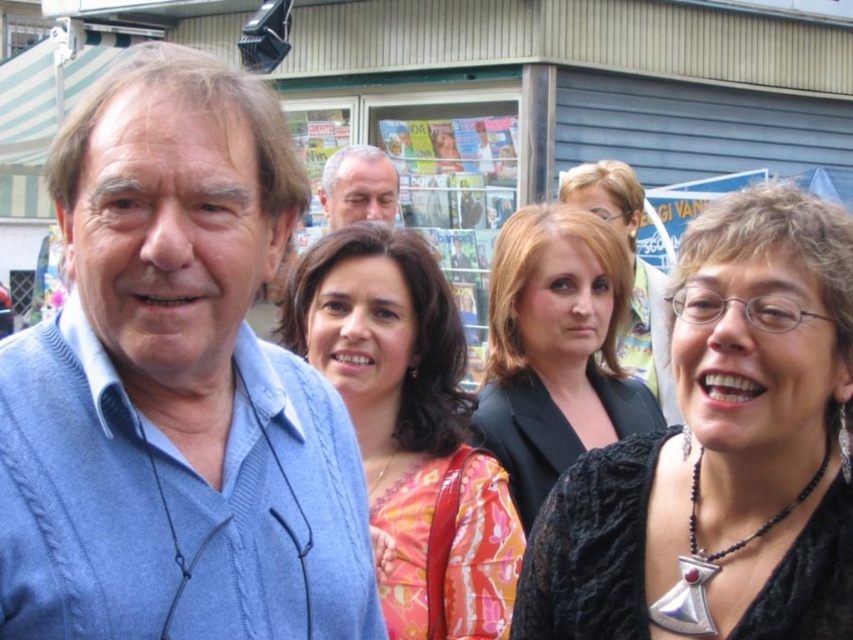
You are a photographer trying to capture a group photo of the orange floral dress at center and the matte black blazer at center. Which one is on the left side when facing the group?

The orange floral dress at center is positioned on the left side of the matte black blazer at center, so when facing the group, the orange floral dress at center is on the left.

You are a photographer trying to capture a group photo of the black lace top at center and the orange floral dress at center. Since you want to ensure both are clearly visible, which clothing item should you focus on first to avoid blurriness due to size differences?

The black lace top at center is smaller than the orange floral dress at center, so you should focus on the orange floral dress at center first to ensure it is in clear focus, as larger objects may require more precise focusing to capture details without blurriness.